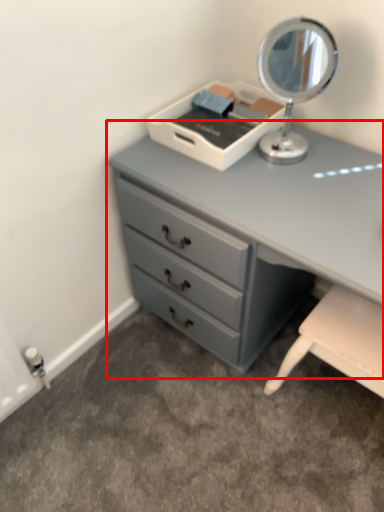
Question: From the image's perspective, what is the correct spatial relationship of chest of drawers (annotated by the red box) in relation to table lamp?

Choices:
 (A) below
 (B) above

Answer: (A)